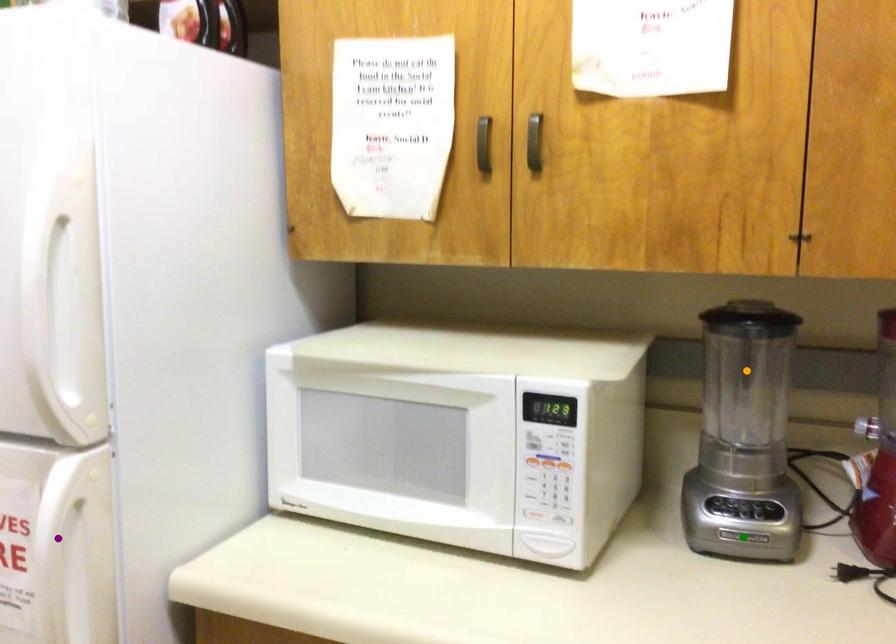
Order these from nearest to farthest:
purple point | orange point | green point

purple point < green point < orange point